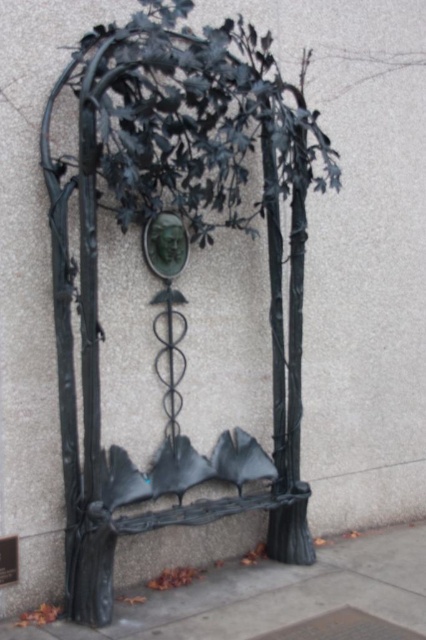
You are a maintenance worker inspecting the sculpture. You notice the green patina mask at center and the smooth concrete pavement at lower center. Which object is located below the other?

The smooth concrete pavement at lower center is positioned under the green patina mask at center, meaning the mask is above the pavement.

You are an artist planning to hang a 12 inch wide painting between the black wrought iron tree at center and the green patina mask at center. Is there enough space?

The black wrought iron tree at center is 18.18 inches from the green patina mask at center. Since the painting is 12 inches wide, there is enough space between them to accommodate it.

You are a photographer setting up a shot of the black wrought iron tree at center and the smooth concrete pavement at lower center. You want to emphasize the height difference between them. Which object should you focus on to highlight its dominance in the scene?

The black wrought iron tree at center is much taller than the smooth concrete pavement at lower center, so focusing on the black wrought iron tree at center will highlight its dominance in the scene.